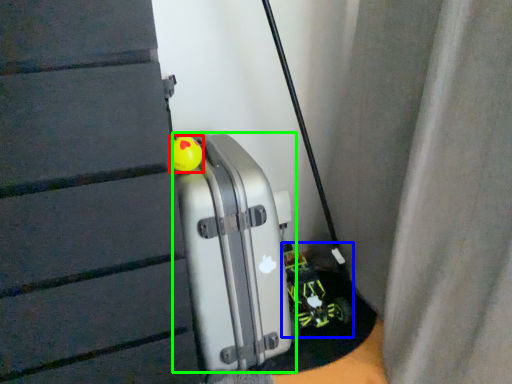
Question: Which object is positioned farthest from toy (highlighted by a red box)? Select from toy car (highlighted by a blue box) and luggage (highlighted by a green box).

Choices:
 (A) toy car
 (B) luggage

Answer: (A)